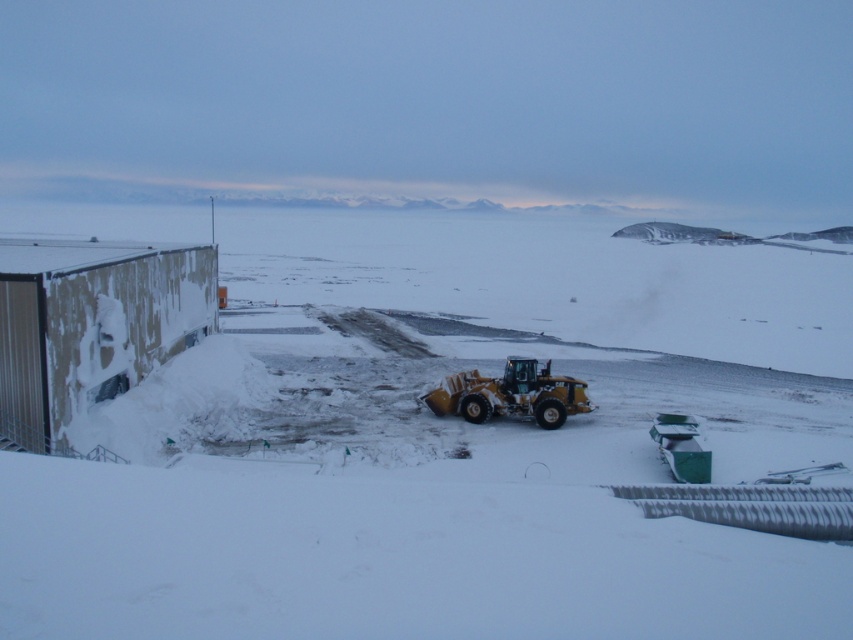
Question: In this image, where is white powdery snow at center located relative to yellow rubber plow at center?

Choices:
 (A) right
 (B) left

Answer: (B)

Question: Is white powdery snow at center above yellow rubber plow at center?

Choices:
 (A) yes
 (B) no

Answer: (A)

Question: Which object is closer to the camera taking this photo?

Choices:
 (A) white powdery snow at center
 (B) yellow rubber plow at center

Answer: (A)

Question: Is white powdery snow at center to the right of yellow rubber plow at center from the viewer's perspective?

Choices:
 (A) no
 (B) yes

Answer: (A)